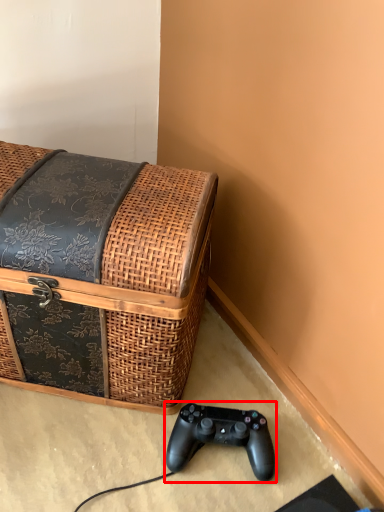
Question: From the image's perspective, what is the correct spatial positioning of game controller (annotated by the red box) in reference to furniture?

Choices:
 (A) above
 (B) below

Answer: (B)